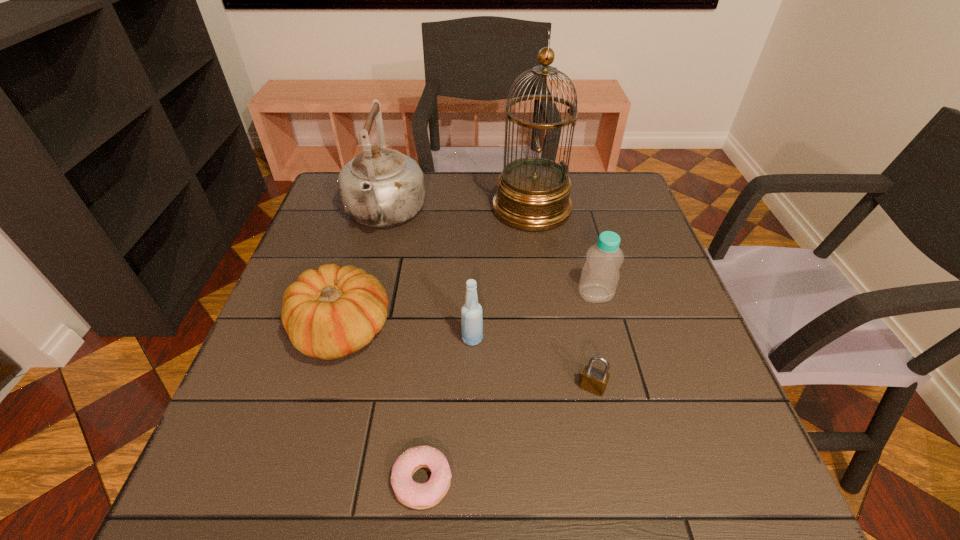
I want to click on kettle that is at the far edge, so click(380, 187).

Locate an element on the screen. The height and width of the screenshot is (540, 960). object that is at the near edge is located at coordinates (414, 495).

This screenshot has height=540, width=960. What are the coordinates of `kettle that is at the left edge` in the screenshot? It's located at (380, 187).

Locate an element on the screen. gourd that is at the left edge is located at coordinates (328, 313).

The height and width of the screenshot is (540, 960). Find the location of `object that is at the right edge`. object that is at the right edge is located at coordinates (600, 275).

Locate an element on the screen. object located at the far left corner is located at coordinates (380, 187).

In the image, there is a desktop. What are the coordinates of `vacant area at the far edge` in the screenshot? It's located at (428, 212).

Find the location of `vacant space at the near edge of the desktop`. vacant space at the near edge of the desktop is located at coordinates (656, 487).

Identify the location of free space at the left edge. (255, 427).

In the image, there is a desktop. In order to click on blank space at the right edge in this screenshot , I will do `click(647, 369)`.